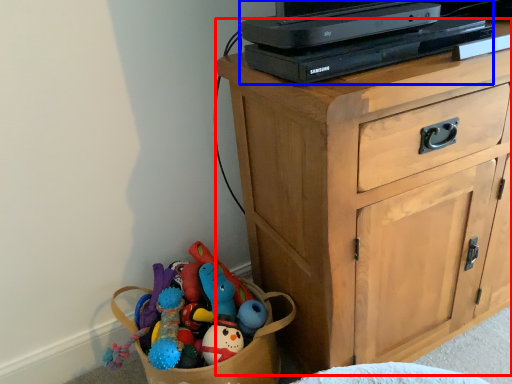
Question: Which object is closer to the camera taking this photo, chest of drawers (highlighted by a red box) or computer (highlighted by a blue box)?

Choices:
 (A) chest of drawers
 (B) computer

Answer: (A)